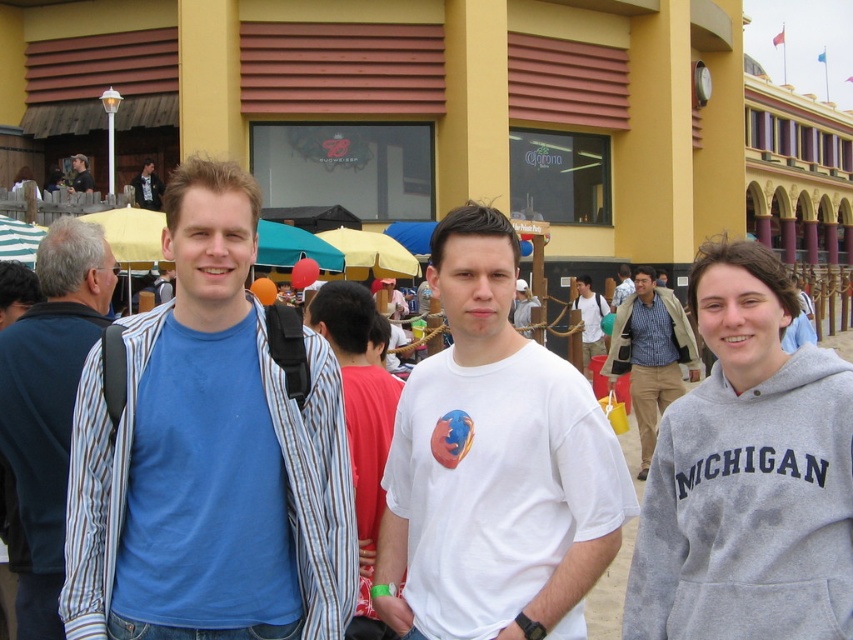
Does blue cotton shirt at center appear under matte black shirt at upper left?

Yes, blue cotton shirt at center is below matte black shirt at upper left.

Who is shorter, blue cotton shirt at center or matte black shirt at upper left?

With less height is blue cotton shirt at center.

Does point (289, 625) come behind point (143, 204)?

No.

I want to click on blue cotton shirt at center, so click(209, 456).

Measure the distance between blue cotton shirt at center and camera.

blue cotton shirt at center and camera are 47.50 feet apart from each other.

Does blue cotton shirt at center appear on the right side of matte black jacket at upper left?

Correct, you'll find blue cotton shirt at center to the right of matte black jacket at upper left.

Does point (166, 374) come closer to viewer compared to point (74, 166)?

Yes, it is in front of point (74, 166).

Identify the location of blue cotton shirt at center. This screenshot has width=853, height=640. (209, 456).

Does white matte t-shirt at center have a lesser width compared to blue striped shirt at left?

Yes.

Is point (500, 538) positioned behind point (102, 257)?

No, it is not.

Is point (566, 428) closer to viewer compared to point (86, 310)?

Yes, point (566, 428) is closer to viewer.

Where is `white matte t-shirt at center`? white matte t-shirt at center is located at coordinates (494, 465).